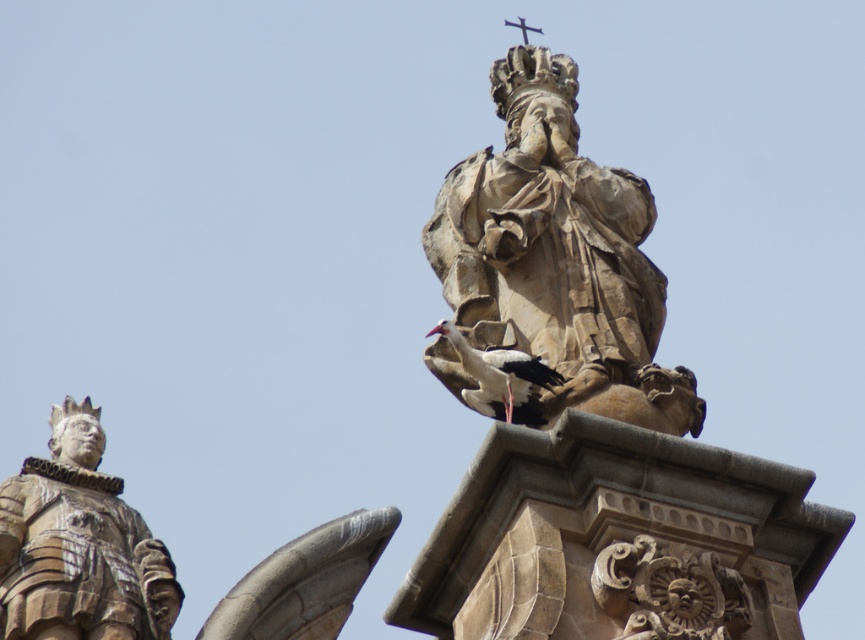
Question: Which of the following is the closest to the observer?

Choices:
 (A) (436, 369)
 (B) (55, 468)
 (C) (58, 435)

Answer: (A)

Question: Which point is closer to the camera taking this photo?

Choices:
 (A) tap(508, 412)
 (B) tap(312, 552)
 (C) tap(479, 193)

Answer: (A)

Question: Is brown stone statue at center bigger than white feathered bird at center?

Choices:
 (A) no
 (B) yes

Answer: (B)

Question: Does brown stone statue at left come behind carved stone statue at left?

Choices:
 (A) yes
 (B) no

Answer: (B)

Question: Which object is the closest to the carved stone statue at left?

Choices:
 (A) brown stone statue at left
 (B) white feathered bird at center
 (C) brown stone statue at center

Answer: (A)

Question: Is brown stone statue at left closer to the viewer compared to white feathered bird at center?

Choices:
 (A) no
 (B) yes

Answer: (A)